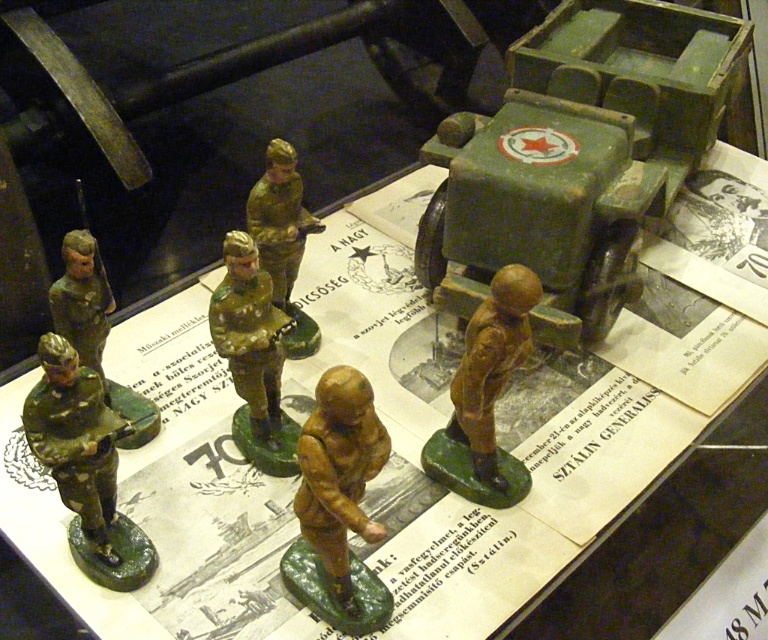
Is green matte toy soldier at center positioned in front of matte green figure at center?

Yes, green matte toy soldier at center is closer to the viewer.

Is green matte toy soldier at center below matte green figure at center?

Correct, green matte toy soldier at center is located below matte green figure at center.

Is point (266, 289) farther from camera compared to point (283, 298)?

No, it is in front of (283, 298).

At what (x,y) coordinates should I click in order to perform the action: click on green matte toy soldier at center. Please return your answer as a coordinate pair (x, y). The image size is (768, 640). Looking at the image, I should click on point(250,332).

Is matte green truck at center closer to the viewer compared to matte green soldier at left?

No, it is not.

Does matte green truck at center appear under matte green soldier at left?

No, matte green truck at center is not below matte green soldier at left.

You are a GUI agent. You are given a task and a screenshot of the screen. Output one action in this format:
    pyautogui.click(x=<x>, y=<y>)
    Task: Click on the matte green truck at center
    This screenshot has height=640, width=768.
    Given the screenshot: What is the action you would take?
    point(578,157)

Does matte green truck at center come behind green matte toy soldier at center?

Yes, matte green truck at center is further from the viewer.

Find the location of a particular element. matte green truck at center is located at coordinates (578, 157).